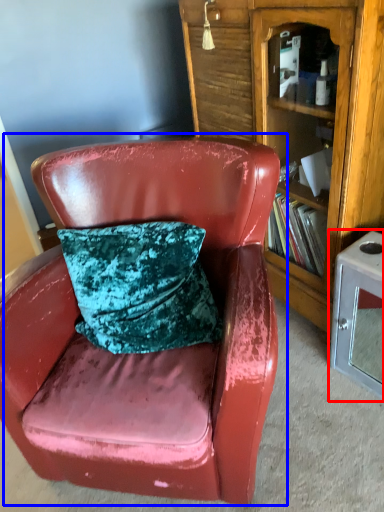
Question: Which object appears farthest to the camera in this image, table (highlighted by a red box) or chair (highlighted by a blue box)?

Choices:
 (A) table
 (B) chair

Answer: (A)